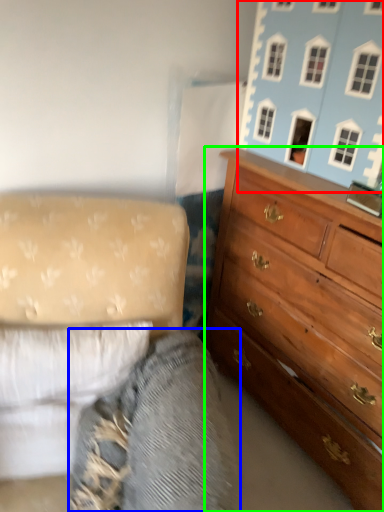
Question: Based on their relative distances, which object is nearer to toy (highlighted by a red box)? Choose from gray (highlighted by a blue box) and chest of drawers (highlighted by a green box).

Choices:
 (A) gray
 (B) chest of drawers

Answer: (B)